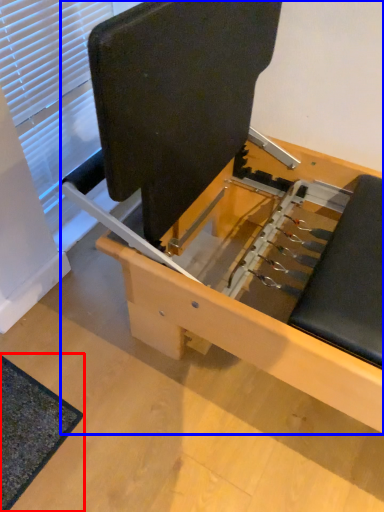
Question: Among these objects, which one is nearest to the camera, mat (highlighted by a red box) or furniture (highlighted by a blue box)?

Choices:
 (A) mat
 (B) furniture

Answer: (B)